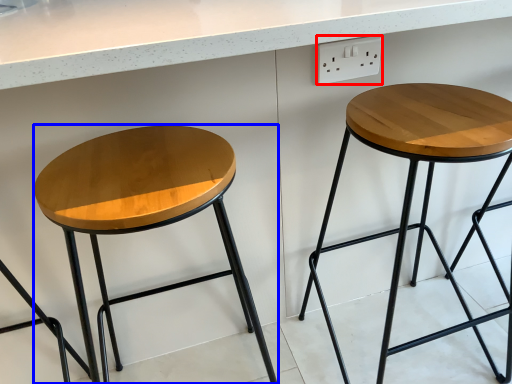
Question: Which object appears farthest to the camera in this image, electric outlet (highlighted by a red box) or stool (highlighted by a blue box)?

Choices:
 (A) electric outlet
 (B) stool

Answer: (A)